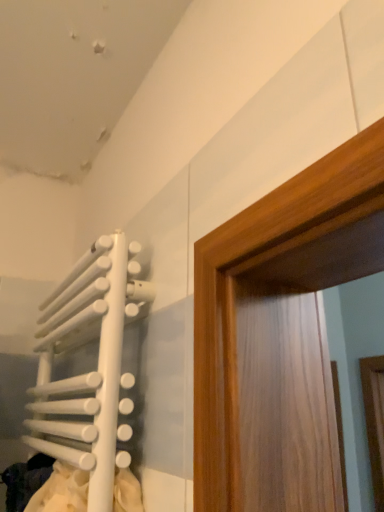
Question: Is white matte radiator at left positioned behind white matte laundry at lower left?

Choices:
 (A) yes
 (B) no

Answer: (B)

Question: From the image's perspective, would you say white matte radiator at left is shown under white matte laundry at lower left?

Choices:
 (A) no
 (B) yes

Answer: (A)

Question: Does white matte radiator at left appear on the left side of white matte laundry at lower left?

Choices:
 (A) yes
 (B) no

Answer: (A)

Question: From the image's perspective, is white matte radiator at left on white matte laundry at lower left?

Choices:
 (A) yes
 (B) no

Answer: (A)

Question: Would you say white matte radiator at left is outside white matte laundry at lower left?

Choices:
 (A) yes
 (B) no

Answer: (A)

Question: Can you confirm if white matte radiator at left is taller than white matte laundry at lower left?

Choices:
 (A) no
 (B) yes

Answer: (B)

Question: Considering the relative sizes of white matte laundry at lower left and white matte radiator at left in the image provided, is white matte laundry at lower left shorter than white matte radiator at left?

Choices:
 (A) yes
 (B) no

Answer: (A)

Question: Does white matte laundry at lower left turn towards white matte radiator at left?

Choices:
 (A) no
 (B) yes

Answer: (B)

Question: Is white matte laundry at lower left positioned in front of white matte radiator at left?

Choices:
 (A) no
 (B) yes

Answer: (A)

Question: From a real-world perspective, is white matte laundry at lower left located beneath white matte radiator at left?

Choices:
 (A) yes
 (B) no

Answer: (A)

Question: Would you say white matte laundry at lower left contains white matte radiator at left?

Choices:
 (A) yes
 (B) no

Answer: (B)

Question: Is white matte radiator at left at the back of white matte laundry at lower left?

Choices:
 (A) no
 (B) yes

Answer: (B)

Question: From the image's perspective, relative to white matte radiator at left, is white matte laundry at lower left above or below?

Choices:
 (A) above
 (B) below

Answer: (B)